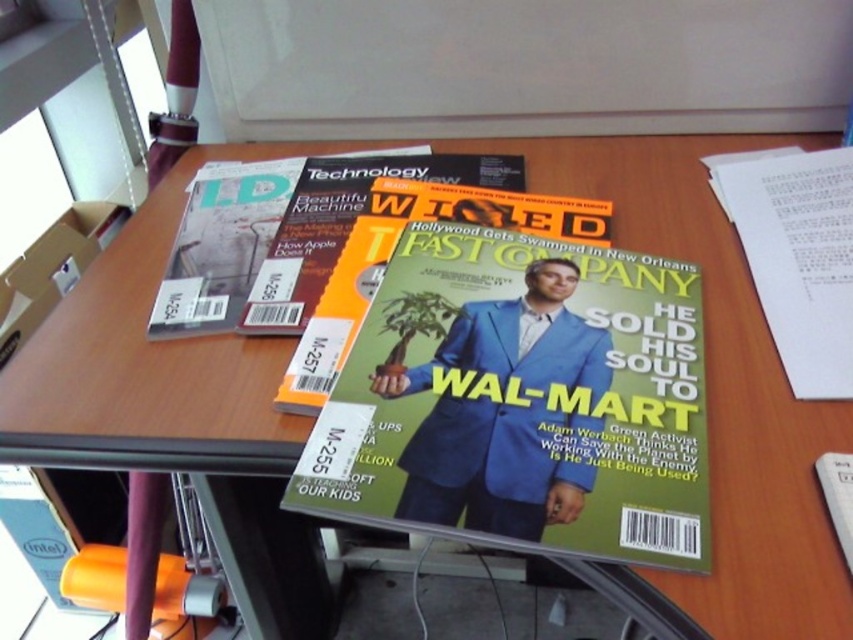
Does green matte magazine at center have a lesser height compared to blue fabric man at center?

No.

Between green matte magazine at center and blue fabric man at center, which one appears on the right side from the viewer's perspective?

green matte magazine at center is more to the right.

What do you see at coordinates (523, 400) in the screenshot?
I see `green matte magazine at center` at bounding box center [523, 400].

Identify the location of green matte magazine at center. The height and width of the screenshot is (640, 853). (523, 400).

Who is more forward, (403, 392) or (373, 156)?

Positioned in front is point (403, 392).

Between blue fabric man at center and matte orange magazine at center, which one has less height?

blue fabric man at center

Is point (555, 490) more distant than point (227, 241)?

No.

The image size is (853, 640). I want to click on blue fabric man at center, so click(x=498, y=465).

Does green matte magazine at center have a lesser height compared to matte orange magazine at center?

No.

Is point (605, 317) closer to viewer compared to point (152, 326)?

Yes, it is in front of point (152, 326).

The image size is (853, 640). Find the location of `green matte magazine at center`. green matte magazine at center is located at coordinates (523, 400).